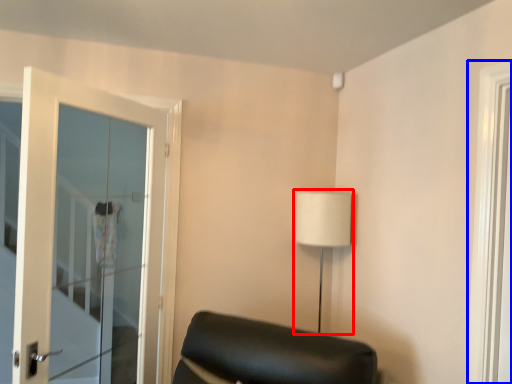
Question: Which of the following is the closest to the observer, table lamp (highlighted by a red box) or window (highlighted by a blue box)?

Choices:
 (A) table lamp
 (B) window

Answer: (B)